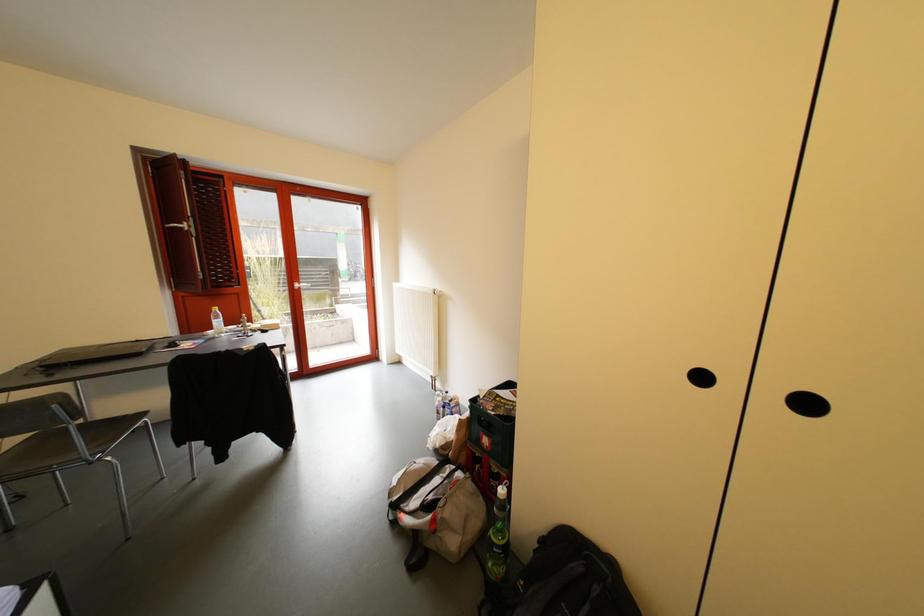
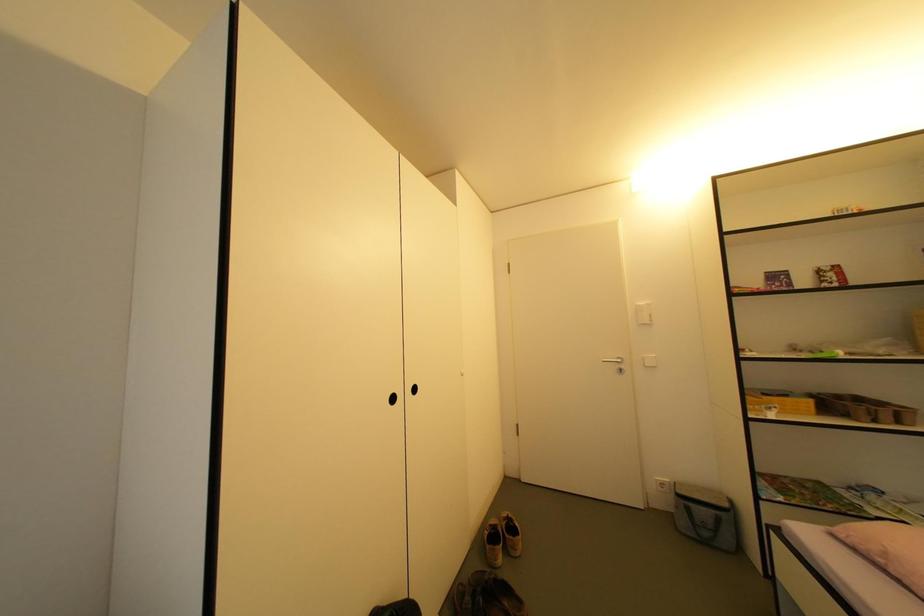
Question: The camera is either moving clockwise (left) or counter-clockwise (right) around the object. The first image is from the beginning of the video and the second image is from the end. Is the camera moving left or right when shooting the video?

Choices:
 (A) Left
 (B) Right

Answer: (A)